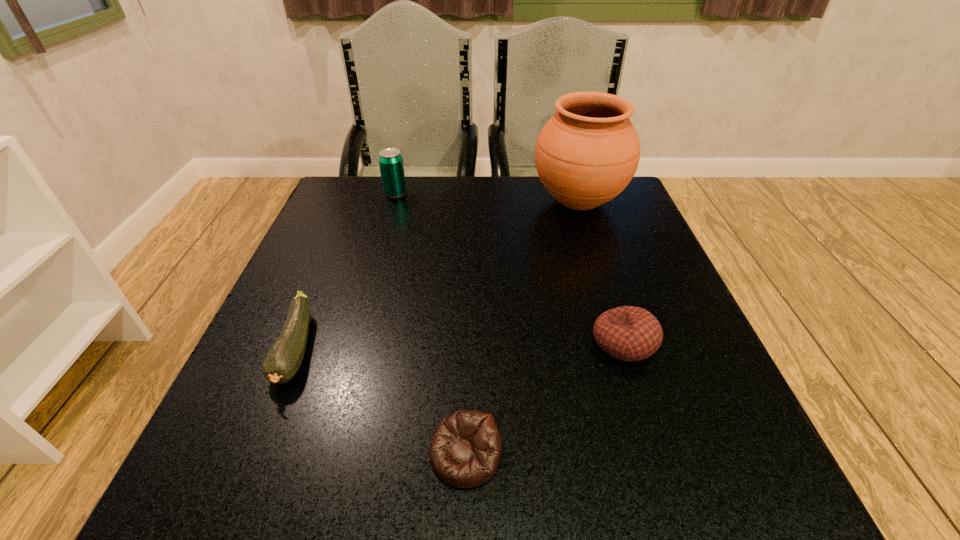
This screenshot has width=960, height=540. I want to click on vacant space positioned on the left of the right beanbag, so click(534, 342).

The image size is (960, 540). Identify the location of free space located on the left of the shorter beanbag. (262, 454).

Find the location of a particular element. The width and height of the screenshot is (960, 540). pottery that is at the far edge is located at coordinates (586, 154).

Locate an element on the screen. This screenshot has height=540, width=960. beer can present at the far edge is located at coordinates (391, 166).

Identify the location of object at the near edge. The height and width of the screenshot is (540, 960). (465, 450).

What are the coordinates of `beer can present at the left edge` in the screenshot? It's located at tap(391, 166).

Where is `zucchini situated at the left edge`? Image resolution: width=960 pixels, height=540 pixels. zucchini situated at the left edge is located at coordinates (284, 359).

What are the coordinates of `pottery that is at the right edge` in the screenshot? It's located at (586, 154).

Locate an element on the screen. Image resolution: width=960 pixels, height=540 pixels. beanbag at the right edge is located at coordinates (628, 333).

At what (x,y) coordinates should I click in order to perform the action: click on object situated at the far left corner. Please return your answer as a coordinate pair (x, y). The width and height of the screenshot is (960, 540). Looking at the image, I should click on (391, 166).